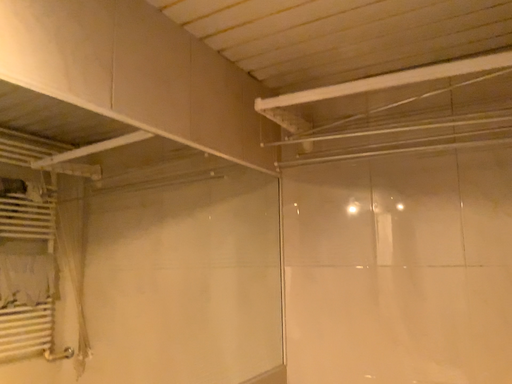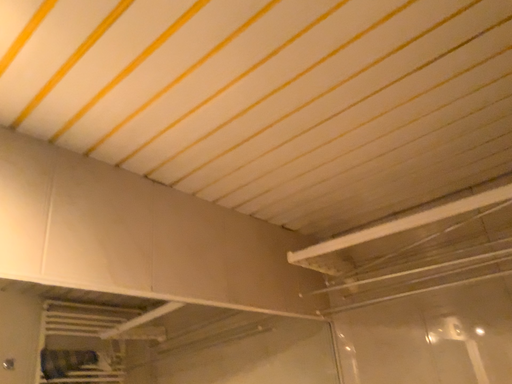
Question: How did the camera likely rotate when shooting the video?

Choices:
 (A) rotated right
 (B) rotated left

Answer: (B)